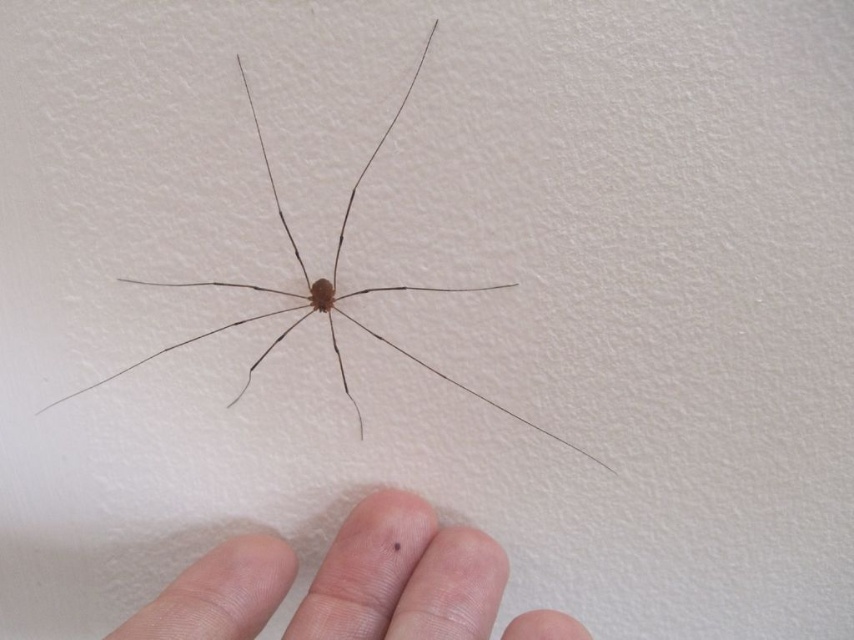
You are a biologist observing the spider. You need to determine if the pale skin finger at lower center can fully cover the brown matte spider at center without overlapping the spider. Based on their widths, can the finger cover the spider?

The pale skin finger at lower center is narrower than the brown matte spider at center, so it cannot fully cover the spider without overlapping.

You are observing a spider on a white surface and notice two points marked on the image. The first point is at coordinates point (218, 602) and the second is at point (529, 426). From your perspective, which point is nearer to you?

Point (218, 602) is closer to the camera than point (529, 426), so the first point is nearer to you.

You are a biologist observing the spider. You notice the pale skin finger at lower center and the brown matte spider at center. Which object is smaller in size?

The pale skin finger at lower center is smaller in size compared to the brown matte spider at center according to the description.